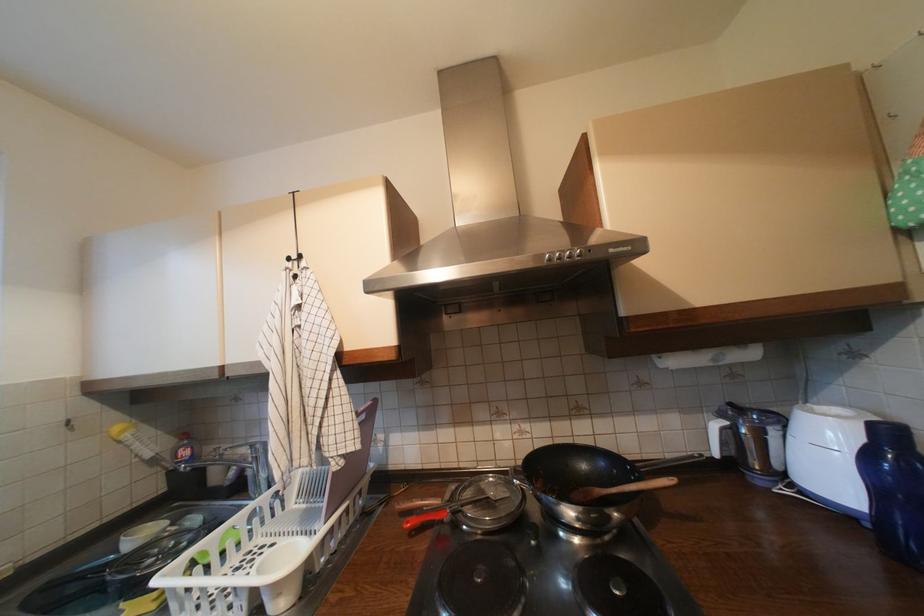
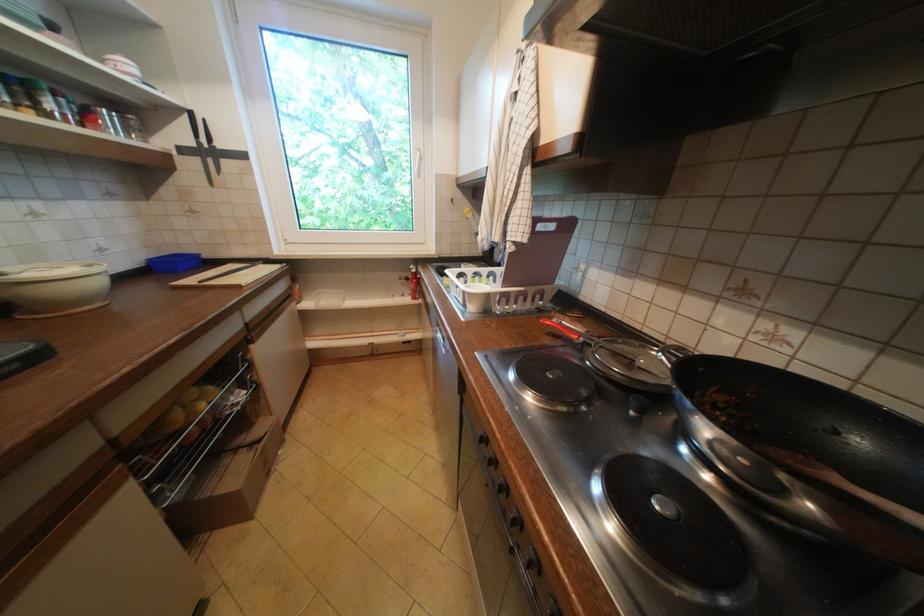
In the second image, find the point that corresponds to the point at 578,513 in the first image.

(715, 430)